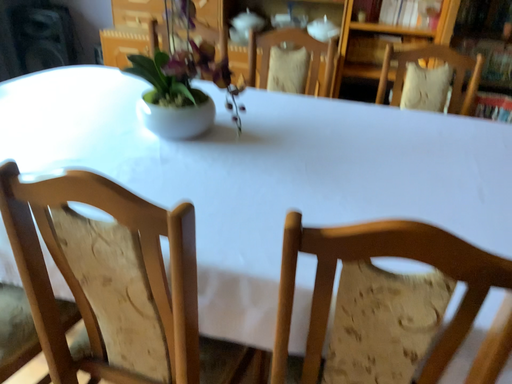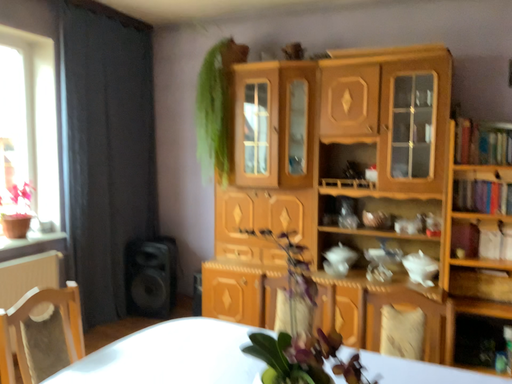
Question: Which way did the camera rotate in the video?

Choices:
 (A) rotated upward
 (B) rotated downward

Answer: (A)